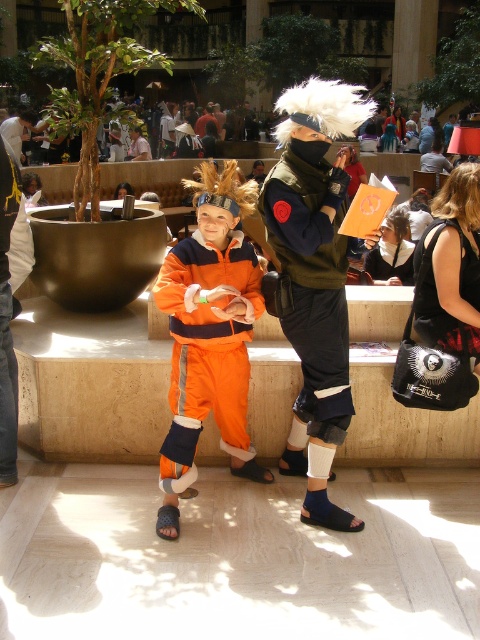
You are an event organizer who needs to place a 10 feet wide banner between the orange fabric pants at center and the dark red fabric shirt at center. Is there enough space between them to fit the banner?

The orange fabric pants at center is 43.60 feet from dark red fabric shirt at center, so yes, the banner can be placed between them since the distance is greater than the banner width.